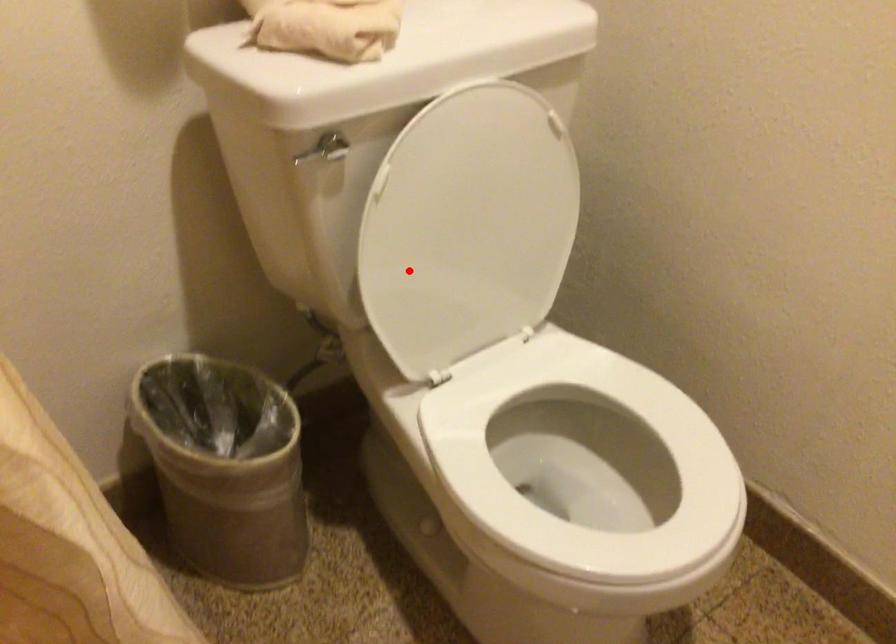
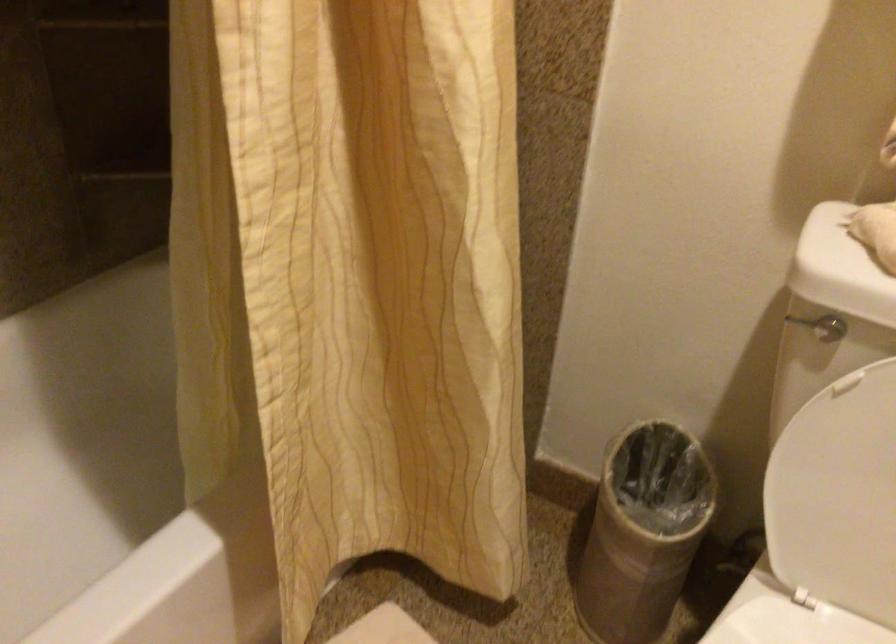
Find the pixel in the second image that matches the highlighted location in the first image.

(834, 480)